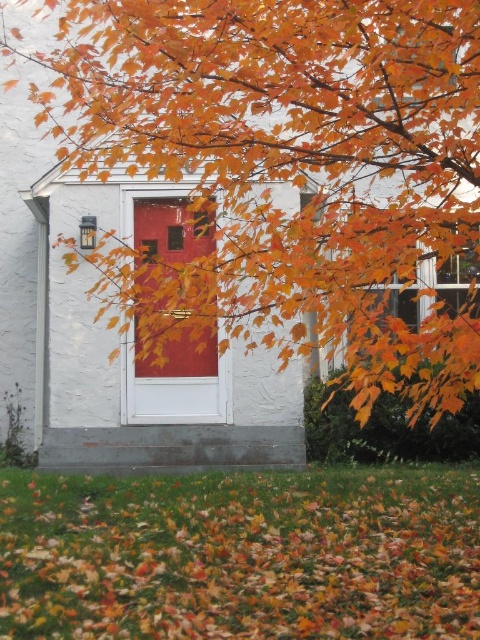
You are standing in front of the house and want to pick up the orange leaf litter at lower center. Which direction should you move relative to the orange leafy branches at center?

You should move to the left relative to the orange leafy branches at center because the orange leafy branches at center is to the right of orange leaf litter at lower center.

You are standing in front of the house and notice the orange leafy branches at center and the orange leaf litter at lower center. Which object is positioned higher in the image?

Answer: The orange leafy branches at center is above the orange leaf litter at lower center, so the orange leafy branches at center is positioned higher in the image.

You are standing in front of the house and want to place a small decorative pot between the orange leaf litter at lower center and the matte red door at center. Based on their positions, which side of the door should you place the pot on?

The orange leaf litter at lower center is to the right of the matte red door at center, so you should place the pot to the right side of the door.